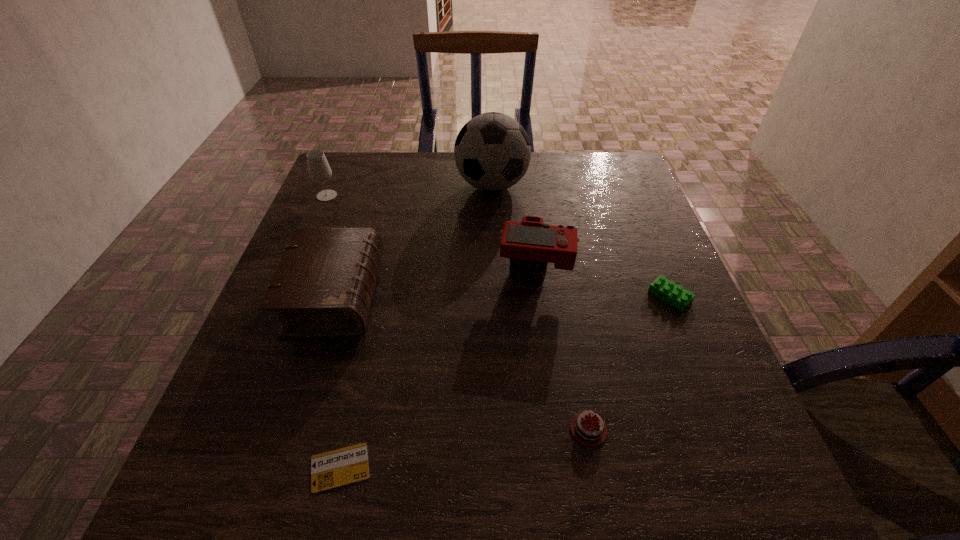
Find the location of a particular element. Image resolution: width=960 pixels, height=540 pixels. free space located 0.360m on the spine side of the fourth shortest object is located at coordinates (547, 296).

What are the coordinates of `free space located 0.110m on the right of the chocolate cake` in the screenshot? It's located at (698, 430).

This screenshot has height=540, width=960. Find the location of `vacant position located 0.360m on the front of the rightmost object`. vacant position located 0.360m on the front of the rightmost object is located at coordinates (752, 496).

I want to click on free spot located 0.320m on the back of the identity card, so click(x=377, y=298).

Image resolution: width=960 pixels, height=540 pixels. I want to click on soccer ball at the far edge, so click(x=492, y=151).

You are a GUI agent. You are given a task and a screenshot of the screen. Output one action in this format:
    pyautogui.click(x=<x>, y=<y>)
    Task: Click on the glass present at the far edge
    
    Given the screenshot: What is the action you would take?
    pyautogui.click(x=319, y=170)

The image size is (960, 540). I want to click on chocolate cake present at the near edge, so click(x=586, y=430).

This screenshot has width=960, height=540. Identify the location of identity card that is at the near edge. (340, 467).

Image resolution: width=960 pixels, height=540 pixels. Identify the location of glass present at the left edge. (319, 170).

You are a GUI agent. You are given a task and a screenshot of the screen. Output one action in this format:
    pyautogui.click(x=<x>, y=<y>)
    Task: Click on the Bible that is at the left edge
    
    Given the screenshot: What is the action you would take?
    pyautogui.click(x=322, y=288)